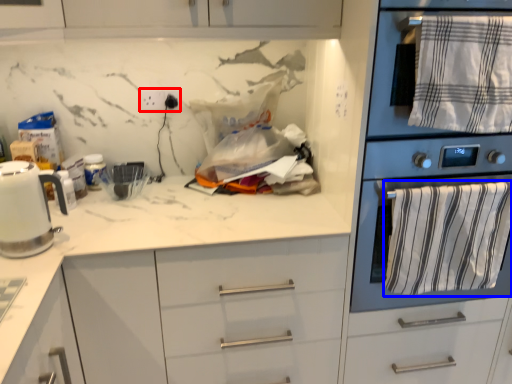
Question: Which object is further to the camera taking this photo, electric outlet (highlighted by a red box) or bath towel (highlighted by a blue box)?

Choices:
 (A) electric outlet
 (B) bath towel

Answer: (A)